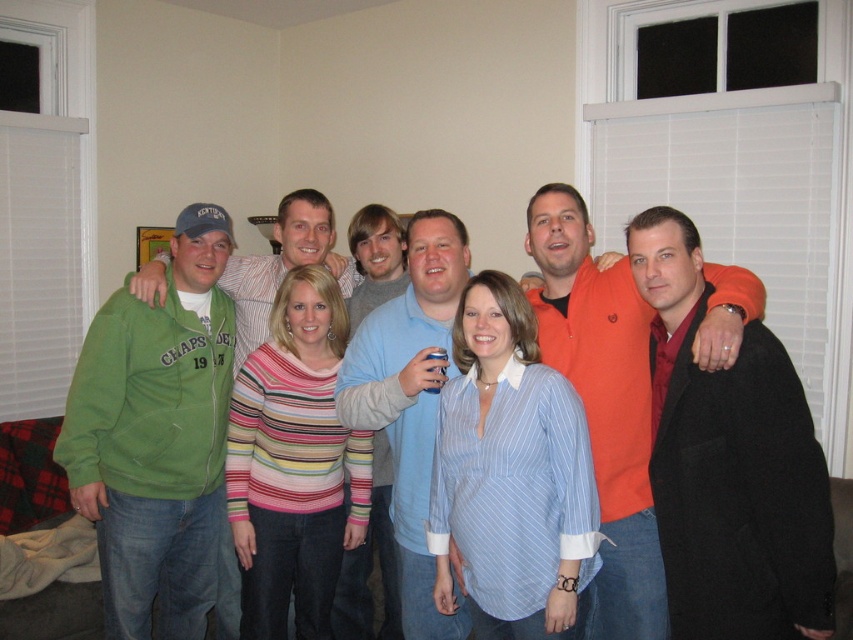
You are taking a photo of the group in the living room. You want to focus on the person at point (254, 513) and the person at point (402, 436). Which point is closer to the camera?

Point (254, 513) is closer to the camera than point (402, 436) because it is further to the camera than the other point.

You are standing at the origin of the coordinate system in the living room. The green fleece jacket at left is located at point (155, 438). If you want to walk directly to the green fleece jacket at left, which direction should you move?

The point (155, 438) indicates the location of the green fleece jacket at left. Since coordinates typically represent positions on a plane, moving towards the x and y coordinates would mean moving right and up respectively. Therefore, to reach the green fleece jacket at left, you should move towards the right and slightly upwards from your current position at the origin.

You are organizing a clothing donation drive and need to determine which of the two sweaters, the striped knit sweater at center or the orange fleece sweater at center, can fit into a standard donation box that has a maximum capacity of 40 liters. Based on their sizes, which one is more likely to fit?

The striped knit sweater at center is smaller than the orange fleece sweater at center, so the striped knit sweater at center is more likely to fit into the 40 liters donation box.